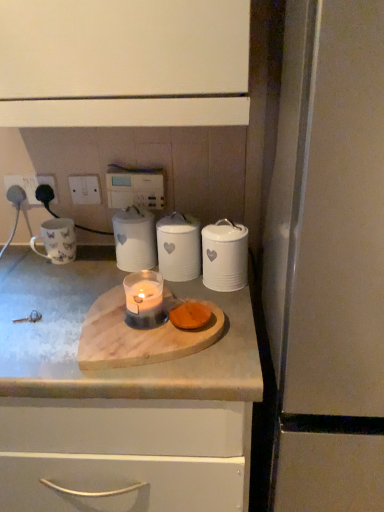
This screenshot has width=384, height=512. What are the coordinates of `free space to the right of translucent glass candle at center` in the screenshot? It's located at (230, 328).